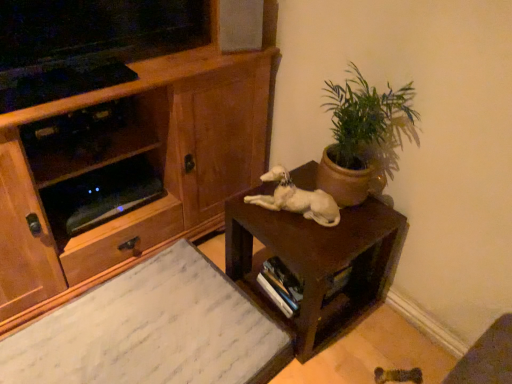
Question: Does green matte plant at upper right have a greater width compared to brown matte table at center?

Choices:
 (A) yes
 (B) no

Answer: (B)

Question: Is green matte plant at upper right turned away from brown matte table at center?

Choices:
 (A) no
 (B) yes

Answer: (A)

Question: From a real-world perspective, is green matte plant at upper right under brown matte table at center?

Choices:
 (A) yes
 (B) no

Answer: (B)

Question: Considering the relative sizes of green matte plant at upper right and brown matte table at center in the image provided, is green matte plant at upper right smaller than brown matte table at center?

Choices:
 (A) yes
 (B) no

Answer: (A)

Question: Would you say green matte plant at upper right is a long distance from brown matte table at center?

Choices:
 (A) yes
 (B) no

Answer: (B)

Question: From the image's perspective, relative to white marble desk at lower left, is green matte plant at upper right above or below?

Choices:
 (A) above
 (B) below

Answer: (A)

Question: In terms of size, does green matte plant at upper right appear bigger or smaller than white marble desk at lower left?

Choices:
 (A) big
 (B) small

Answer: (B)

Question: From their relative heights in the image, would you say green matte plant at upper right is taller or shorter than white marble desk at lower left?

Choices:
 (A) short
 (B) tall

Answer: (B)

Question: Considering their positions, is green matte plant at upper right located in front of or behind white marble desk at lower left?

Choices:
 (A) behind
 (B) front

Answer: (A)

Question: From the image's perspective, is brown matte table at center positioned above or below green matte plant at upper right?

Choices:
 (A) below
 (B) above

Answer: (A)

Question: Considering the positions of point (345, 317) and point (368, 127), is point (345, 317) closer or farther from the camera than point (368, 127)?

Choices:
 (A) closer
 (B) farther

Answer: (B)

Question: Considering the positions of brown matte table at center and green matte plant at upper right in the image, is brown matte table at center taller or shorter than green matte plant at upper right?

Choices:
 (A) short
 (B) tall

Answer: (A)

Question: From a real-world perspective, relative to green matte plant at upper right, is brown matte table at center vertically above or below?

Choices:
 (A) below
 (B) above

Answer: (A)

Question: From the image's perspective, is wooden cabinet at left positioned above or below white glossy dog at center?

Choices:
 (A) above
 (B) below

Answer: (A)

Question: Is wooden cabinet at left in front of or behind white glossy dog at center in the image?

Choices:
 (A) behind
 (B) front

Answer: (B)